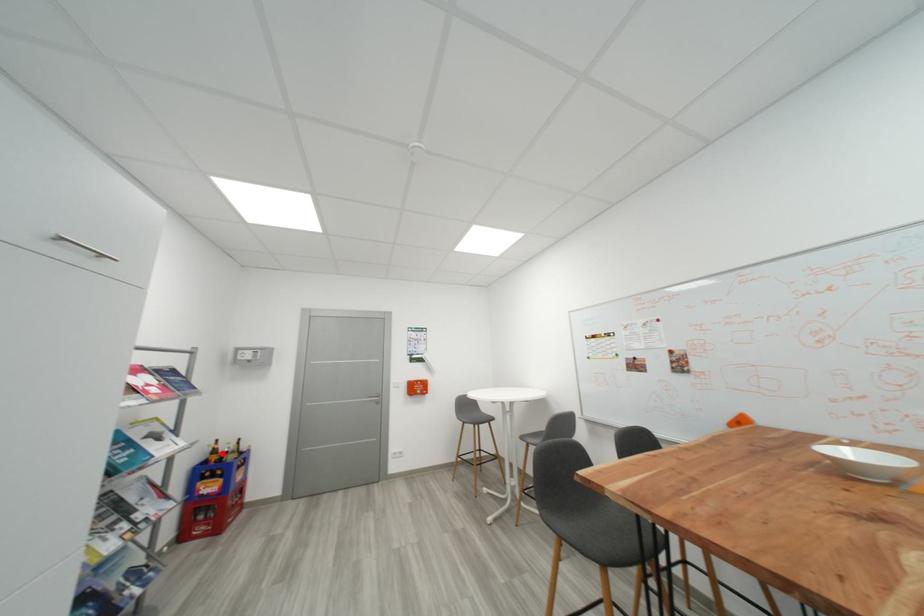
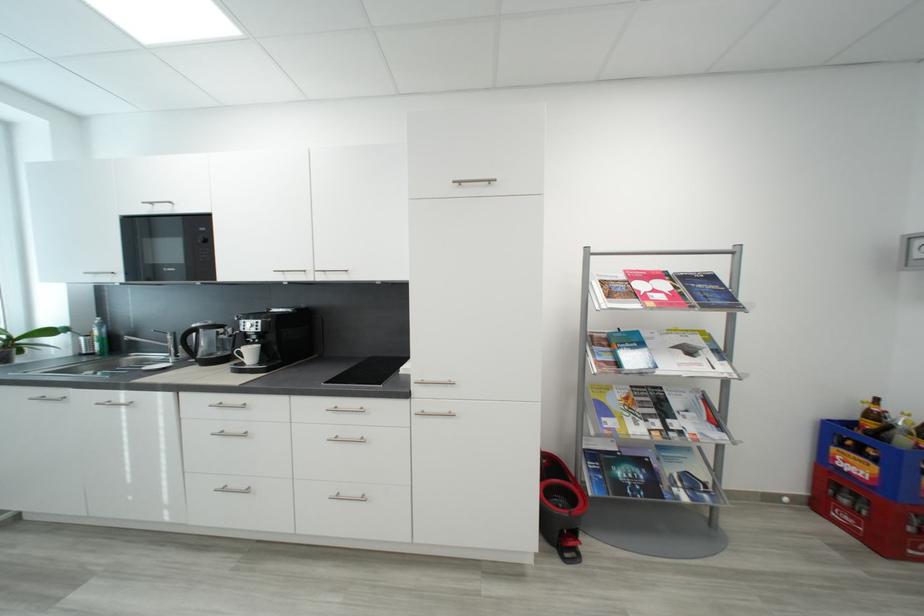
Question: I am providing you with two images of the same scene from different viewpoints. Given a red point in image1, look at the same physical point in image2. Is it:

Choices:
 (A) Closer to the viewpoint
 (B) Farther from the viewpoint

Answer: (A)